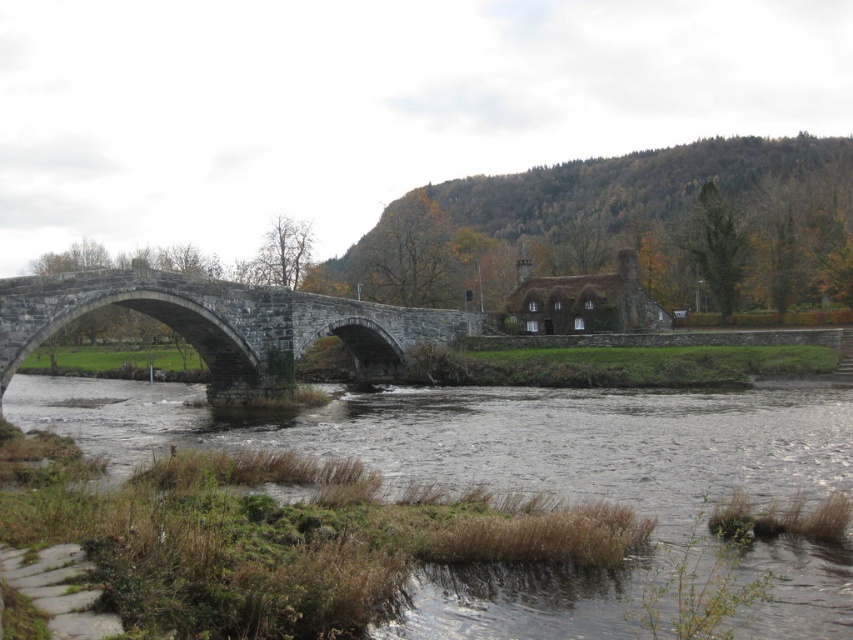
This screenshot has width=853, height=640. Describe the element at coordinates (502, 470) in the screenshot. I see `brown grassy river at lower left` at that location.

Where is `brown grassy river at lower left`? The image size is (853, 640). brown grassy river at lower left is located at coordinates (502, 470).